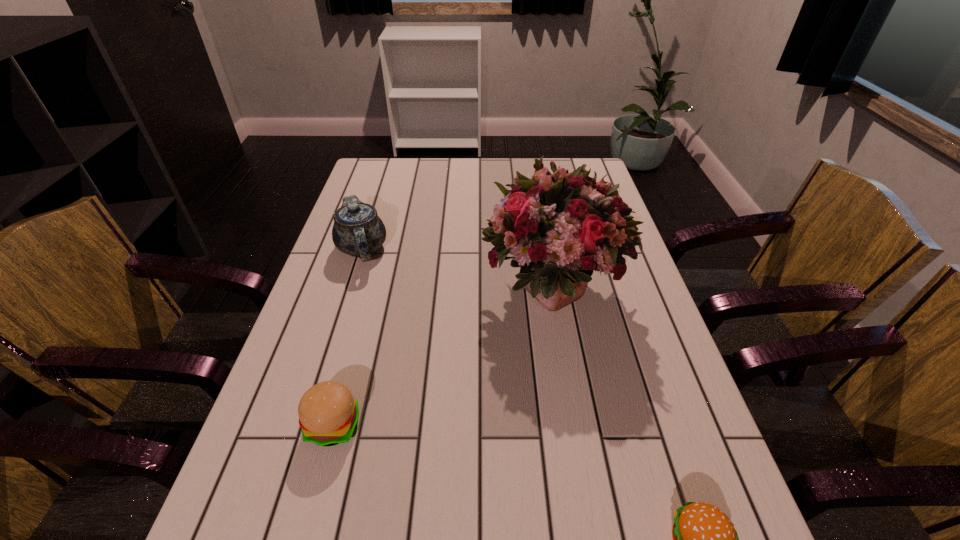
The width and height of the screenshot is (960, 540). In the image, there is a desktop. Find the location of `vacant space at the far edge`. vacant space at the far edge is located at coordinates (473, 162).

The image size is (960, 540). In the image, there is a desktop. Find the location of `free region at the left edge`. free region at the left edge is located at coordinates (347, 379).

Identify the location of vacant space at the right edge of the desktop. (654, 377).

In the image, there is a desktop. Where is `vacant area at the far left corner`? vacant area at the far left corner is located at coordinates (398, 175).

At what (x,y) coordinates should I click in order to perform the action: click on empty space that is in between the third farthest object and the tallest object. Please return your answer as a coordinate pair (x, y). Looking at the image, I should click on (443, 357).

You are a GUI agent. You are given a task and a screenshot of the screen. Output one action in this format:
    pyautogui.click(x=<x>, y=<y>)
    Task: Click on the vacant space that is in between the bouquet and the chinaware
    This screenshot has width=960, height=540.
    Given the screenshot: What is the action you would take?
    pyautogui.click(x=457, y=269)

The image size is (960, 540). Find the location of `unoccupied area between the left hamburger and the second tallest object`. unoccupied area between the left hamburger and the second tallest object is located at coordinates (348, 337).

This screenshot has height=540, width=960. I want to click on free area in between the farther hamburger and the bouquet, so click(443, 357).

You are a GUI agent. You are given a task and a screenshot of the screen. Output one action in this format:
    pyautogui.click(x=<x>, y=<y>)
    Task: Click on the free space between the left hamburger and the tallest object
    This screenshot has height=540, width=960.
    Given the screenshot: What is the action you would take?
    tap(443, 357)

Locate an element on the screen. This screenshot has height=540, width=960. free space that is in between the second tallest object and the farther hamburger is located at coordinates (348, 337).